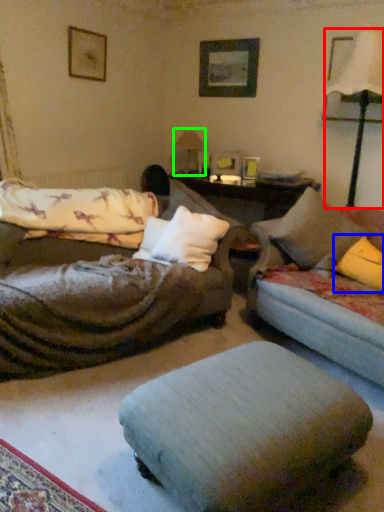
Question: Which is farther away from table lamp (highlighted by a red box)? pillow (highlighted by a blue box) or table lamp (highlighted by a green box)?

Choices:
 (A) pillow
 (B) table lamp

Answer: (B)